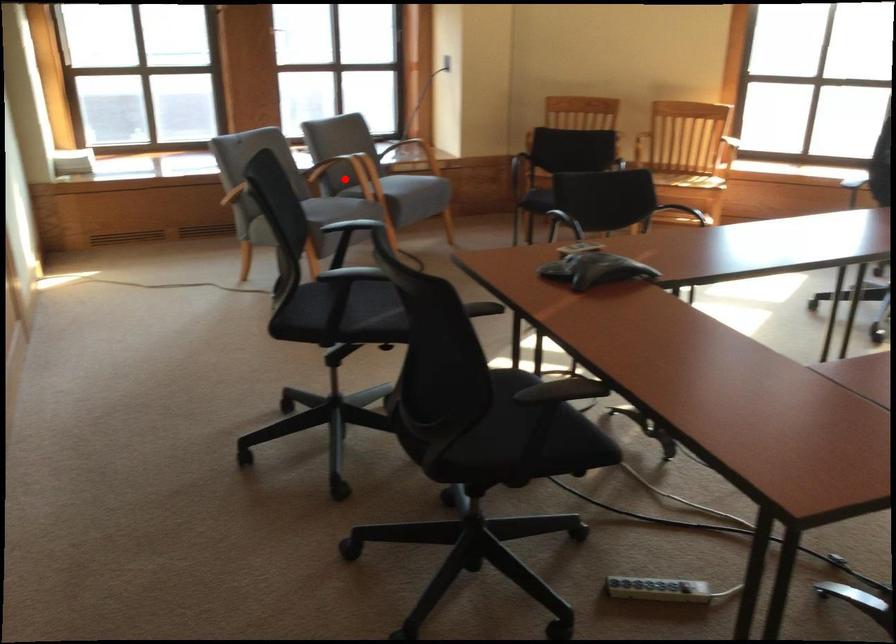
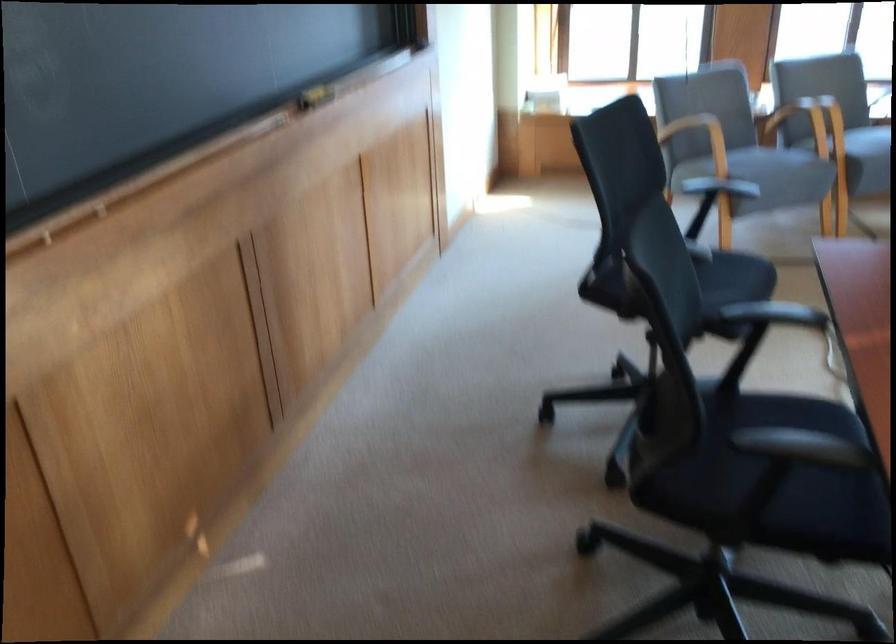
Where in the second image is the point corresponding to the highlighted location from the first image?

(799, 122)